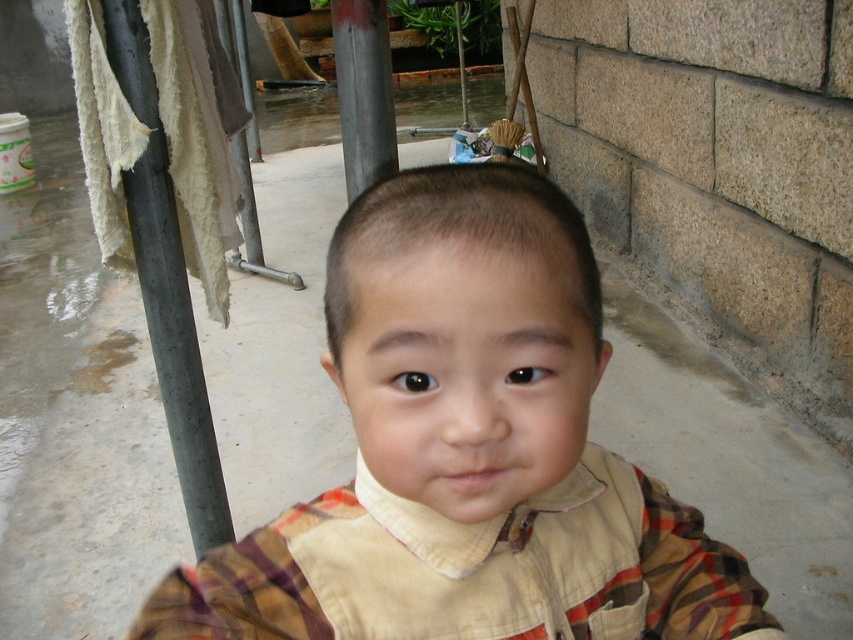
Is plaid fabric at center below metallic pole at upper center?

Indeed, plaid fabric at center is positioned under metallic pole at upper center.

Is plaid fabric at center bigger than metallic pole at upper center?

No, plaid fabric at center is not bigger than metallic pole at upper center.

You are a GUI agent. You are given a task and a screenshot of the screen. Output one action in this format:
    pyautogui.click(x=<x>, y=<y>)
    Task: Click on the plaid fabric at center
    This screenshot has width=853, height=640.
    Given the screenshot: What is the action you would take?
    [x=471, y=570]

Find the location of a particular element. This screenshot has width=853, height=640. plaid fabric at center is located at coordinates (471, 570).

Which is below, plaid fabric at center or metallic gray pole at left?

plaid fabric at center is lower down.

Between point (639, 634) and point (173, 323), which one is positioned behind?

The point (173, 323) is more distant.

This screenshot has height=640, width=853. What do you see at coordinates (471, 570) in the screenshot? I see `plaid fabric at center` at bounding box center [471, 570].

Where is `plaid fabric at center`? The height and width of the screenshot is (640, 853). plaid fabric at center is located at coordinates (471, 570).

Where is `light brown fabric shirt at center`? light brown fabric shirt at center is located at coordinates (467, 451).

I want to click on light brown fabric shirt at center, so click(x=467, y=451).

The width and height of the screenshot is (853, 640). I want to click on light brown fabric shirt at center, so click(467, 451).